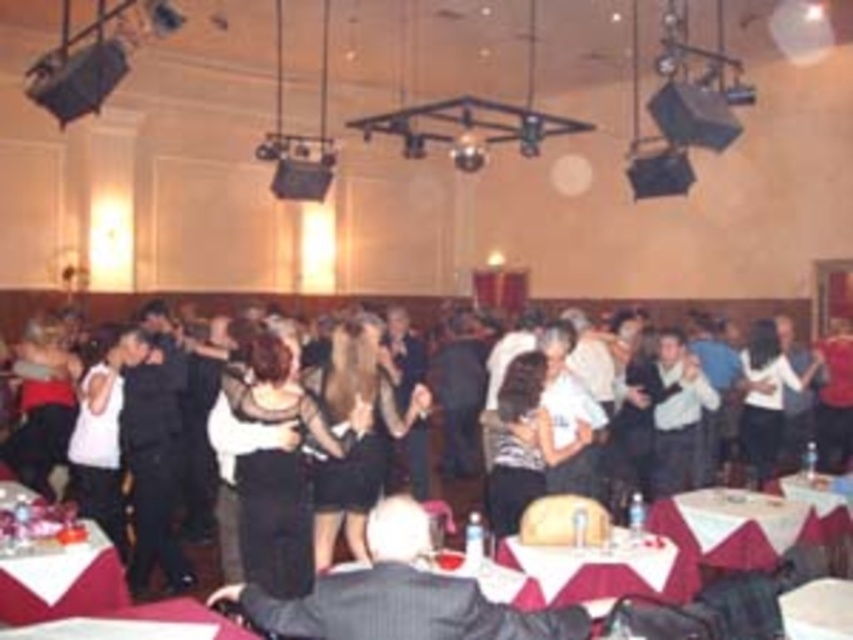
Question: Can you confirm if dark gray suit at lower center is positioned to the left of smooth white tablecloth at lower left?

Choices:
 (A) yes
 (B) no

Answer: (B)

Question: Which point is closer to the camera taking this photo?

Choices:
 (A) (805, 602)
 (B) (381, 531)

Answer: (B)

Question: Can you confirm if dark gray suit at lower center is positioned to the left of smooth white table at lower center?

Choices:
 (A) yes
 (B) no

Answer: (B)

Question: Where is smooth white tablecloth at lower left located in relation to white paper at lower right in the image?

Choices:
 (A) above
 (B) below

Answer: (A)

Question: Which point is closer to the camera?

Choices:
 (A) black satin dress at center
 (B) smooth white tablecloth at lower left

Answer: (B)

Question: Which of these objects is positioned farthest from the dark gray suit at lower center?

Choices:
 (A) white tablecloth at lower center
 (B) white paper at lower right

Answer: (A)